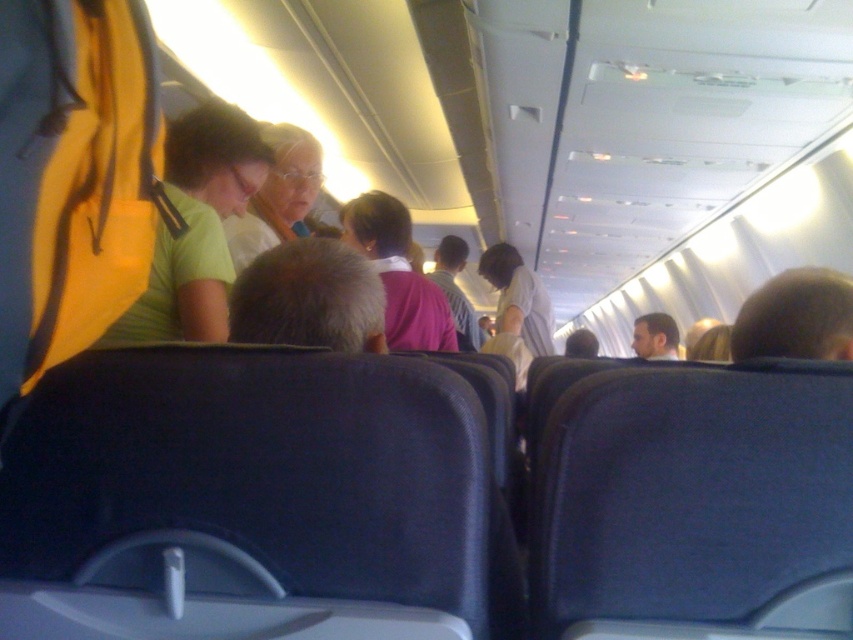
You are a passenger seated in the airplane cabin and want to ask the white fabric flight attendant at center a question. You notice the green matte shirt at upper left. Which of the two is closer to you if you are sitting in the middle of the cabin?

The green matte shirt at upper left is smaller in size compared to the white fabric flight attendant at center, so the white fabric flight attendant at center is closer to you.

You are a passenger seated in the airplane cabin and want to ask the flight attendant for a drink. You notice the green matte shirt at upper left and the white fabric flight attendant at center. Which of these two is shorter in height?

The green matte shirt at upper left is not as tall as the white fabric flight attendant at center, so the green matte shirt at upper left is shorter.